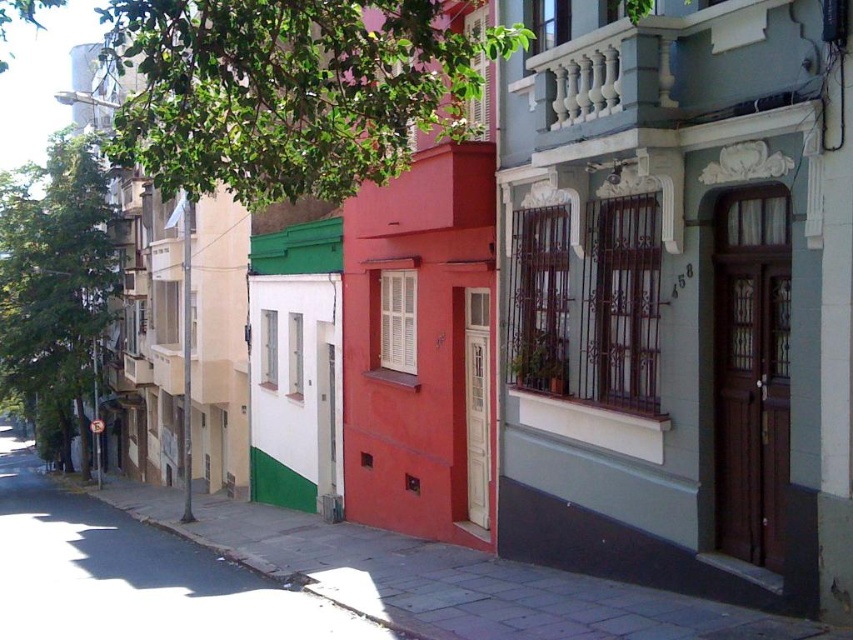
You are a delivery person trying to deliver a package to the green matte wall at center. You are standing on the smooth concrete sidewalk at lower center. Can you reach the wall without climbing anything?

The smooth concrete sidewalk at lower center is not as tall as the green matte wall at center, so you can reach the wall without needing to climb anything since the sidewalk is lower.

You are a delivery person with a cart that is 10 feet wide. You need to move from the smooth concrete sidewalk at lower center to the green matte wall at center. Is there enough space for your cart to fit between them?

The smooth concrete sidewalk at lower center and green matte wall at center are 10.78 feet apart from each other. Since the cart is 10 feet wide, there is enough space for the cart to fit between them as the distance is slightly larger than the cart width.

You are standing on the street in front of the row of colorful buildings. There are two points marked on the ground in front of you. One is at coordinate point (323, 524) and the other is at point (15, 454). Which point is closer to you?

Point (323, 524) is closer to the viewer than point (15, 454).